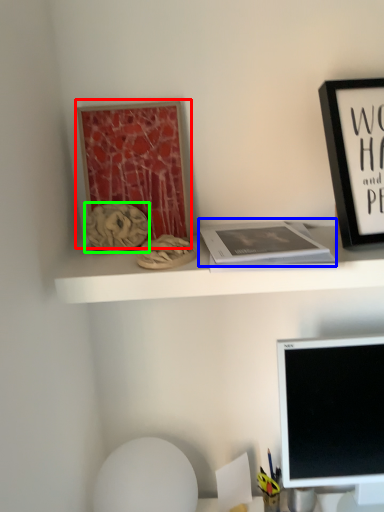
Question: Considering the real-world distances, which object is closest to bulletin board (highlighted by a red box)? paperback book (highlighted by a blue box) or art (highlighted by a green box).

Choices:
 (A) paperback book
 (B) art

Answer: (B)